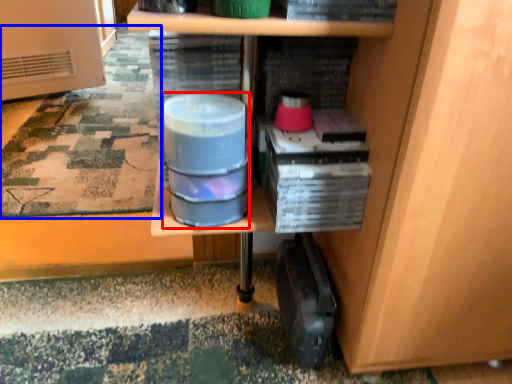
Question: Which object is closer to the camera taking this photo, water (highlighted by a red box) or mat (highlighted by a blue box)?

Choices:
 (A) water
 (B) mat

Answer: (A)